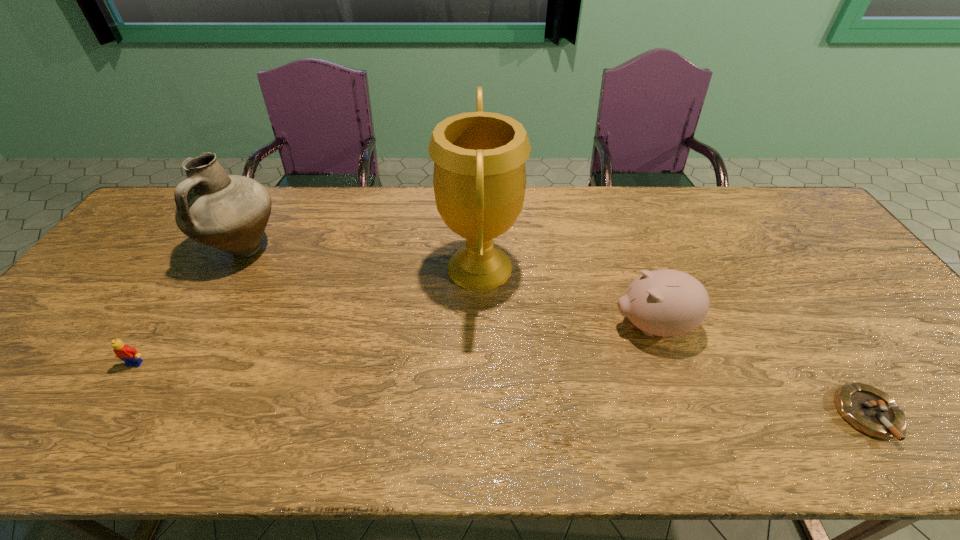
This screenshot has width=960, height=540. In the image, there is a desktop. What are the coordinates of `vacant region at the near edge` in the screenshot? It's located at (577, 418).

This screenshot has width=960, height=540. In order to click on vacant space at the left edge of the desktop in this screenshot , I will do `click(3, 384)`.

Where is `free space at the right edge`? free space at the right edge is located at coordinates (828, 247).

Image resolution: width=960 pixels, height=540 pixels. I want to click on unoccupied area between the fourth shortest object and the shortest object, so pos(557,332).

The height and width of the screenshot is (540, 960). In order to click on vacant space that's between the second tallest object and the third object from right to left in this screenshot , I will do `click(362, 258)`.

Locate an element on the screen. vacant space that's between the pitcher and the ashtray is located at coordinates (557, 332).

The width and height of the screenshot is (960, 540). Identify the location of vacant space that's between the third object from right to left and the nearest object. (674, 341).

Image resolution: width=960 pixels, height=540 pixels. I want to click on vacant area that lies between the Lego and the trophy, so click(x=307, y=315).

The image size is (960, 540). I want to click on free space between the piggy bank and the nearest object, so click(760, 370).

Where is `empty space that is in between the piggy bank and the tallest object`? The image size is (960, 540). empty space that is in between the piggy bank and the tallest object is located at coordinates (566, 296).